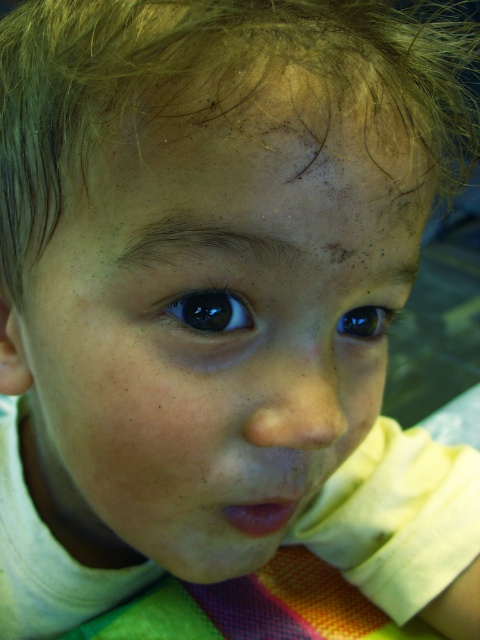
Question: Which object is farther from the camera taking this photo?

Choices:
 (A) smooth skin face at center
 (B) dark blue eye at center
 (C) glossy blue eye at center
 (D) blonde fine hair at upper center

Answer: (B)

Question: Does blonde fine hair at upper center have a lesser width compared to dark blue eye at center?

Choices:
 (A) yes
 (B) no

Answer: (B)

Question: Which of the following is the closest to the observer?

Choices:
 (A) glossy blue eye at center
 (B) blonde fine hair at upper center

Answer: (B)

Question: Which is farther from the dark blue eye at center?

Choices:
 (A) glossy blue eye at center
 (B) smooth skin face at center

Answer: (B)

Question: Is smooth skin face at center to the right of blonde fine hair at upper center from the viewer's perspective?

Choices:
 (A) yes
 (B) no

Answer: (B)

Question: Does blonde fine hair at upper center appear over dark blue eye at center?

Choices:
 (A) yes
 (B) no

Answer: (A)